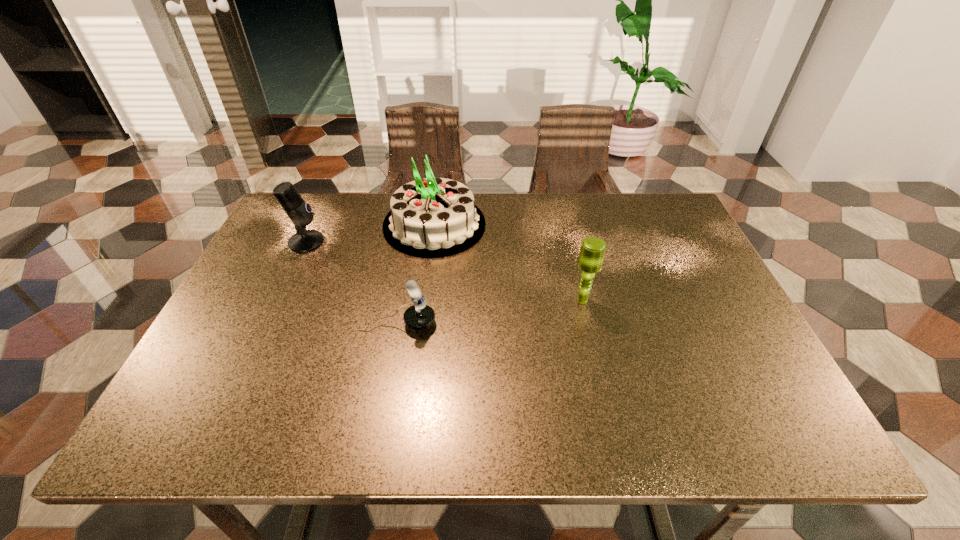
Find the location of a particular element. vacant area that lies between the birthday cake and the shortest object is located at coordinates (416, 274).

Identify which object is the third closest to the second farthest microphone. Please provide its 2D coordinates. Your answer should be formatted as a tuple, i.e. [(x, y)], where the tuple contains the x and y coordinates of a point satisfying the conditions above.

[(300, 213)]

What are the coordinates of `object that stands as the closest to the leftmost microphone` in the screenshot? It's located at (432, 217).

Identify which microphone is located as the nearest to the rightmost object. Please provide its 2D coordinates. Your answer should be formatted as a tuple, i.e. [(x, y)], where the tuple contains the x and y coordinates of a point satisfying the conditions above.

[(420, 316)]

I want to click on microphone that is the second closest to the rightmost object, so click(300, 213).

You are a GUI agent. You are given a task and a screenshot of the screen. Output one action in this format:
    pyautogui.click(x=<x>, y=<y>)
    Task: Click on the free space that satisfies the following two spatial constraints: 1. on the stand of the rightmost object; 2. on the left side of the leftmost microphone
    The height and width of the screenshot is (540, 960).
    Given the screenshot: What is the action you would take?
    pyautogui.click(x=279, y=300)

Image resolution: width=960 pixels, height=540 pixels. I want to click on blank area in the image that satisfies the following two spatial constraints: 1. on the front side of the birthday cake; 2. on the stand of the farthest microphone, so click(432, 242).

Where is `vacant space that satisfies the following two spatial constraints: 1. on the stand of the farthest microphone; 2. on the right side of the shortest object`? vacant space that satisfies the following two spatial constraints: 1. on the stand of the farthest microphone; 2. on the right side of the shortest object is located at coordinates pos(269,323).

Image resolution: width=960 pixels, height=540 pixels. What are the coordinates of `free space that satisfies the following two spatial constraints: 1. on the stand of the second nearest object; 2. on the left side of the leftmost object` in the screenshot? It's located at (279, 300).